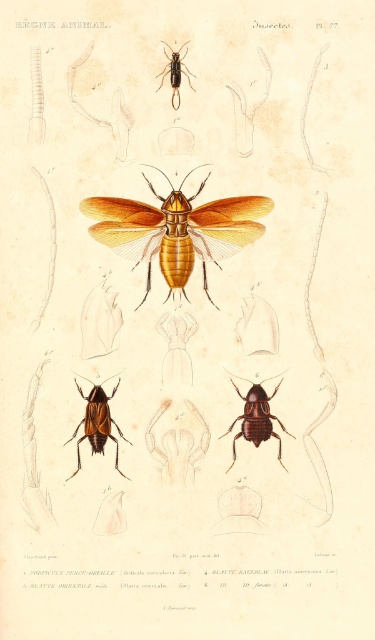
You are an entomologist examining the illustration. You need to determine which beetle is wider based on their positions. Which beetle, the shiny brown beetle at center or the shiny black beetle at upper center, is wider?

The shiny brown beetle at center is wider than the shiny black beetle at upper center according to the illustration.

You are a researcher examining the botanical illustration of insects. You notice a point marked at coordinates (97,422). Based on the scene, what does this point most likely indicate?

The point marked at coordinates (97,422) most likely indicates the location of the shiny brown beetle at center, as specified in the description.

You are an entomologist examining the illustration. You need to locate the shiny brown beetle at lower center and the shiny black beetle at upper center. Which beetle is placed higher in the image?

The shiny black beetle at upper center is placed higher in the image than the shiny brown beetle at lower center.